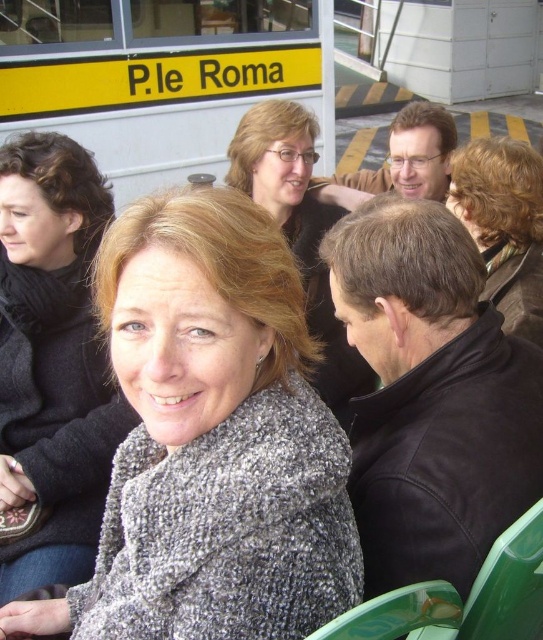
Question: Based on their relative distances, which object is farther from the smooth black jacket at center?

Choices:
 (A) dark brown hair at upper right
 (B) gray knitted shawl at center
 (C) gray textured scarf at center

Answer: (B)

Question: Does gray textured scarf at center lie behind dark brown hair at upper right?

Choices:
 (A) no
 (B) yes

Answer: (A)

Question: Which point is closer to the camera?

Choices:
 (A) (308, 150)
 (B) (123, 410)

Answer: (B)

Question: Can you confirm if gray textured scarf at center is wider than smooth black jacket at center?

Choices:
 (A) yes
 (B) no

Answer: (B)

Question: Does smooth black jacket at center have a greater width compared to dark brown hair at upper right?

Choices:
 (A) no
 (B) yes

Answer: (B)

Question: Which is farther from the gray textured scarf at center?

Choices:
 (A) dark brown hair at upper right
 (B) smooth black jacket at center

Answer: (A)